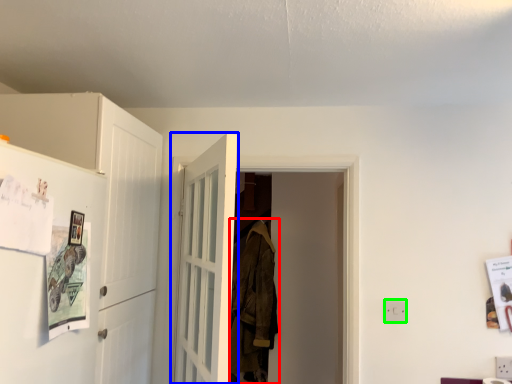
Question: Which object is the farthest from laundry (highlighted by a red box)? Choose among these: door (highlighted by a blue box) or electric outlet (highlighted by a green box).

Choices:
 (A) door
 (B) electric outlet

Answer: (B)